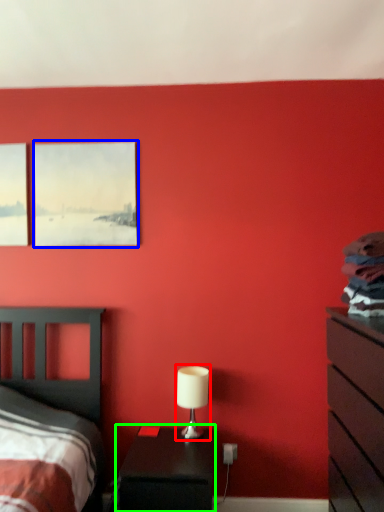
Question: Which object is positioned closest to table lamp (highlighted by a red box)? Select from picture frame (highlighted by a blue box) and nightstand (highlighted by a green box).

Choices:
 (A) picture frame
 (B) nightstand

Answer: (B)